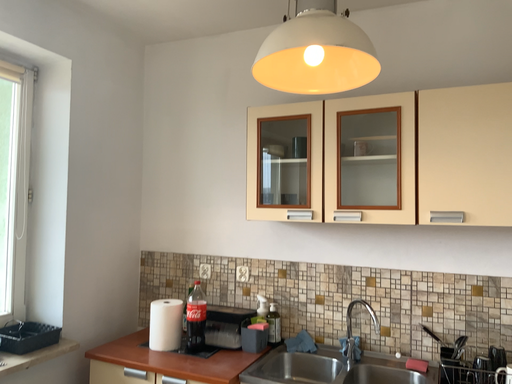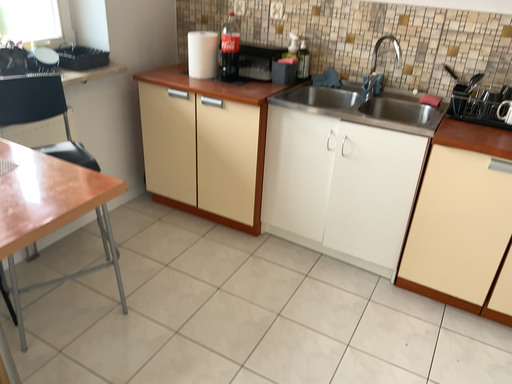
Question: How did the camera likely rotate when shooting the video?

Choices:
 (A) rotated upward
 (B) rotated downward

Answer: (B)